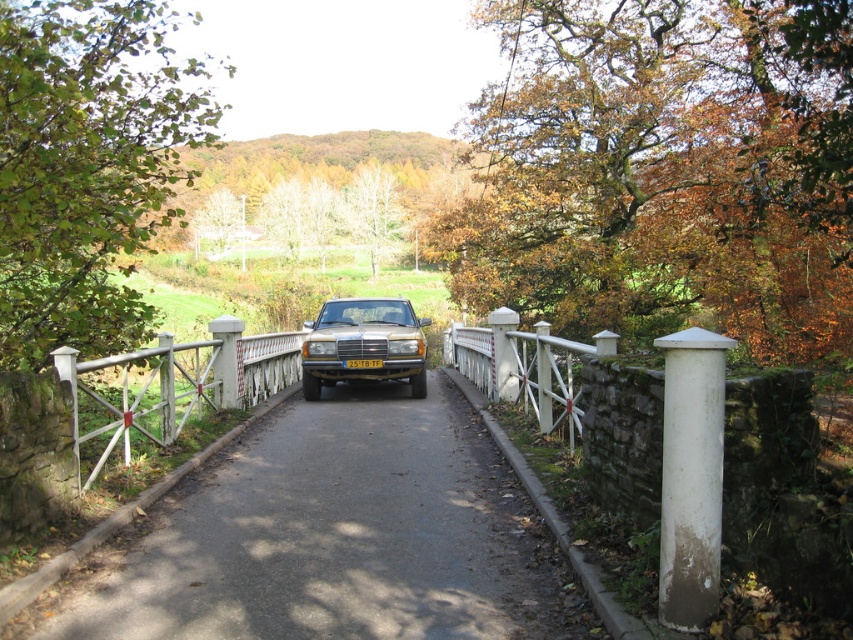
Question: Does black asphalt road at center have a greater width compared to white painted wood fence at center?

Choices:
 (A) no
 (B) yes

Answer: (B)

Question: Which object is farther from the camera taking this photo?

Choices:
 (A) yellow matte license plate at center
 (B) gold metallic car at center
 (C) white painted wood fence at center

Answer: (A)

Question: Is gold metallic car at center further to camera compared to yellow matte license plate at center?

Choices:
 (A) yes
 (B) no

Answer: (B)

Question: Which of the following is the farthest from the observer?

Choices:
 (A) white painted wood fence at center
 (B) gold metallic car at center
 (C) black asphalt road at center
 (D) yellow matte license plate at center

Answer: (D)

Question: Considering the real-world distances, which object is farthest from the white painted wood fence at center?

Choices:
 (A) yellow matte license plate at center
 (B) black asphalt road at center

Answer: (A)

Question: Does white painted wood fence at center have a lesser width compared to yellow matte license plate at center?

Choices:
 (A) yes
 (B) no

Answer: (A)